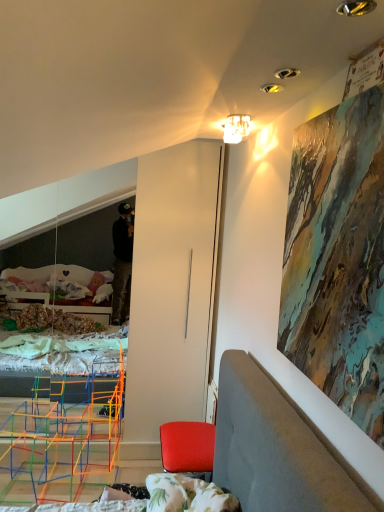
Question: From the image's perspective, is red leather chair at lower right positioned above or below matte glass chandelier at upper center?

Choices:
 (A) below
 (B) above

Answer: (A)

Question: In terms of size, does red leather chair at lower right appear bigger or smaller than matte glass chandelier at upper center?

Choices:
 (A) small
 (B) big

Answer: (B)

Question: Is red leather chair at lower right wider or thinner than matte glass chandelier at upper center?

Choices:
 (A) thin
 (B) wide

Answer: (B)

Question: From the image's perspective, relative to red leather chair at lower right, is matte glass chandelier at upper center above or below?

Choices:
 (A) below
 (B) above

Answer: (B)

Question: From a real-world perspective, is matte glass chandelier at upper center above or below red leather chair at lower right?

Choices:
 (A) below
 (B) above

Answer: (B)

Question: Is matte glass chandelier at upper center taller or shorter than red leather chair at lower right?

Choices:
 (A) tall
 (B) short

Answer: (B)

Question: Considering the relative positions of matte glass chandelier at upper center and red leather chair at lower right in the image provided, is matte glass chandelier at upper center to the left or to the right of red leather chair at lower right?

Choices:
 (A) right
 (B) left

Answer: (A)